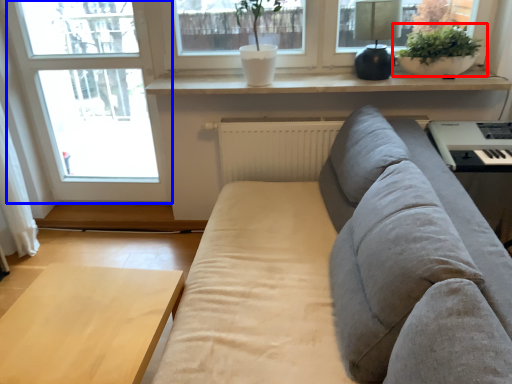
Question: Which of the following is the farthest to the observer, houseplant (highlighted by a red box) or window (highlighted by a blue box)?

Choices:
 (A) houseplant
 (B) window

Answer: (B)